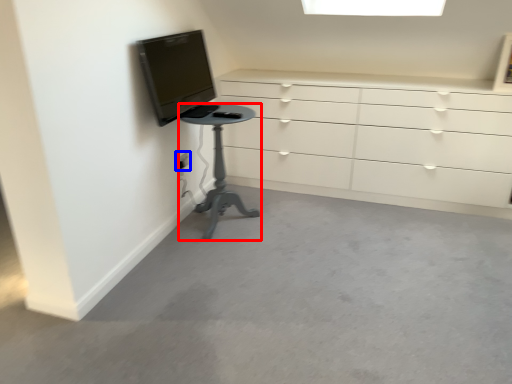
Question: Which of the following is the closest to the observer, furniture (highlighted by a red box) or electric outlet (highlighted by a blue box)?

Choices:
 (A) furniture
 (B) electric outlet

Answer: (A)